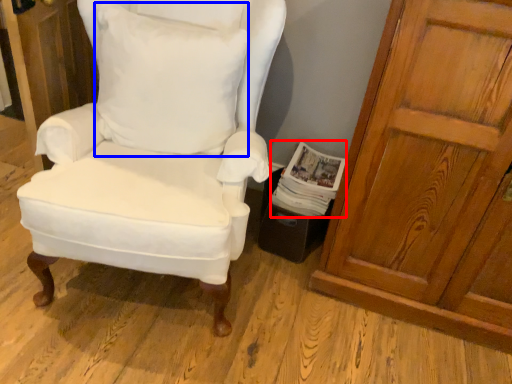
Question: Which object appears closest to the camera in this image, magazine (highlighted by a red box) or pillow (highlighted by a blue box)?

Choices:
 (A) magazine
 (B) pillow

Answer: (B)